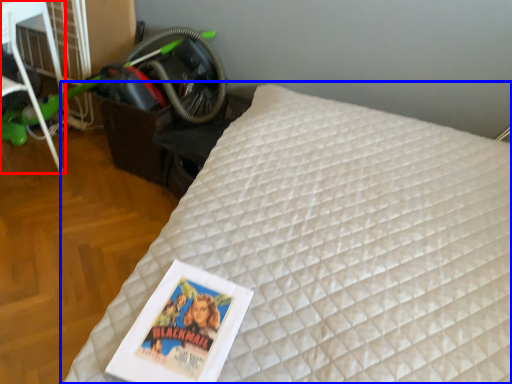
Question: Among these objects, which one is nearest to the camera, furniture (highlighted by a red box) or bed (highlighted by a blue box)?

Choices:
 (A) furniture
 (B) bed

Answer: (B)